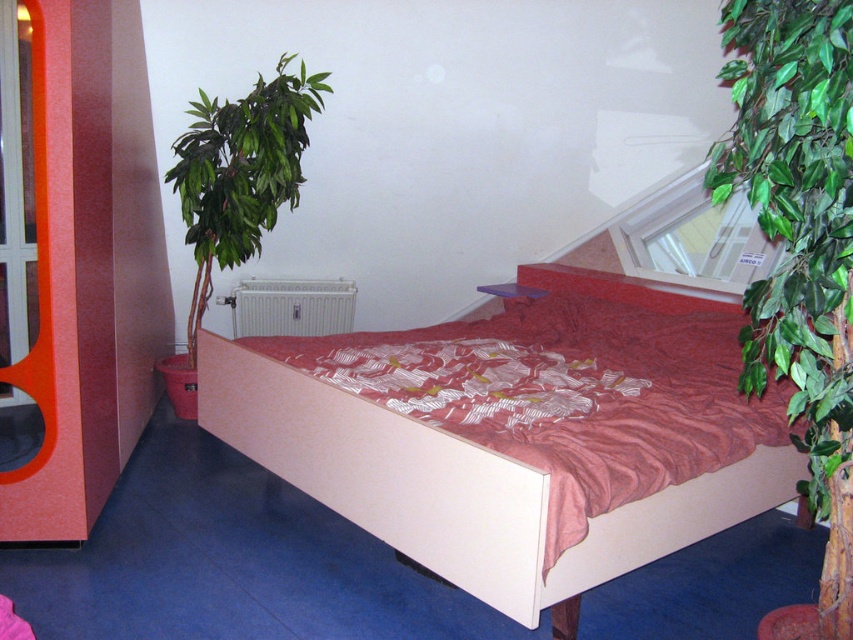
You are moving a small table that is 1 meter wide into the bedroom. The table needs to fit between the green leafy plant at left and the white metallic radiator at center. Based on the scene, can the table fit in that space?

The green leafy plant at left might be wider than the white metallic radiator at center, so the space between them may not be wide enough to accommodate the 1 meter wide table. It is uncertain if the table will fit without further measurement.

You are standing in the bedroom and want to reach the point marked as point (538, 522). If you can move 5 feet per second, how long will it take you to reach that point?

The distance between you and point (538, 522) is 6.33 feet. At a speed of 5 feet per second, it would take approximately 1.266 seconds to reach the point.

You are standing in the bedroom and want to place a new lamp on the nightstand. To reach the nightstand, you need to walk around either the matte white bed at center or the white metallic radiator at center. Which object should you go around to access the nightstand?

You should go around the white metallic radiator at center because the matte white bed at center is positioned on the right side of the white metallic radiator at center, meaning the radiator is closer to the nightstand.